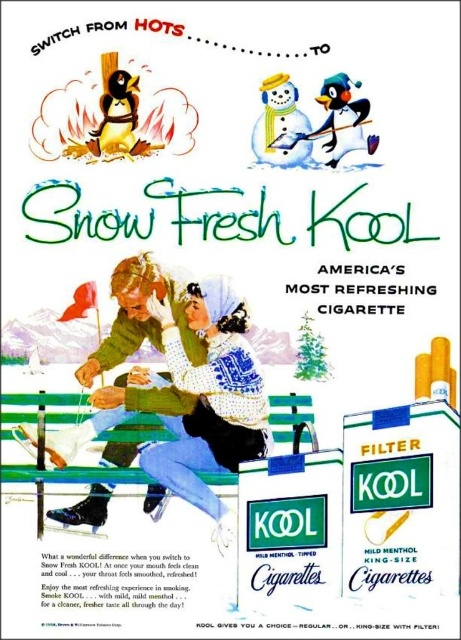
You are designing a layout for a new advertisement and need to place both the green wooden bench at center and the white matte snowman at upper center. Based on their widths, which object should you place first to ensure they fit properly?

The green wooden bench at center has a lesser width compared to the white matte snowman at upper center, so you should place the white matte snowman at upper center first to accommodate its larger size.

Consider the image. You are standing in the scene and want to pick up the green knitted sweater at center and the green wooden bench at center. Which object is easier to reach without moving your position?

The green knitted sweater at center is closer to you than the green wooden bench at center, so it is easier to reach without moving.